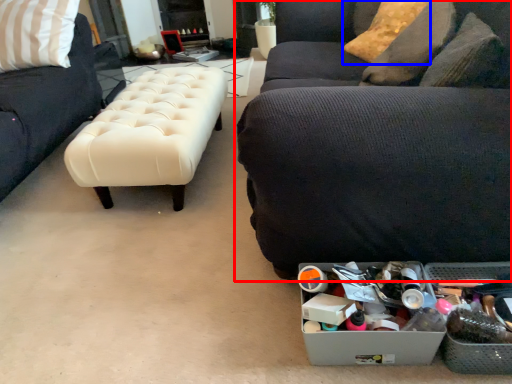
Question: Which point is further to the camera, studio couch (highlighted by a red box) or pillow (highlighted by a blue box)?

Choices:
 (A) studio couch
 (B) pillow

Answer: (B)